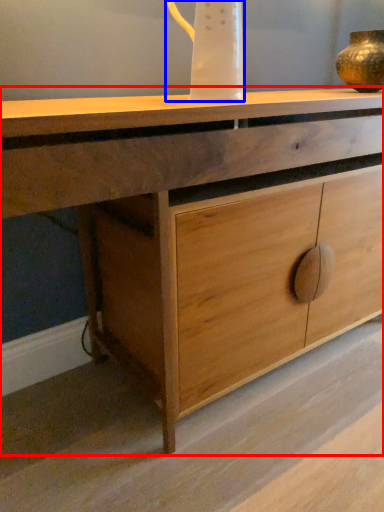
Question: Which object is closer to the camera taking this photo, chest of drawers (highlighted by a red box) or jug (highlighted by a blue box)?

Choices:
 (A) chest of drawers
 (B) jug

Answer: (A)